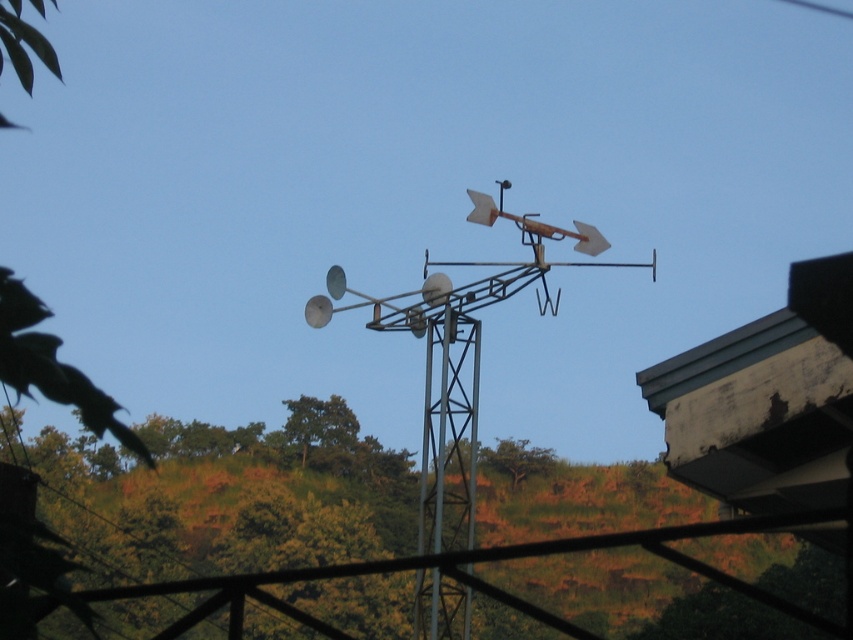
This screenshot has width=853, height=640. In order to click on metallic silver vane at center in this screenshot , I will do `click(459, 356)`.

Can you confirm if metallic silver vane at center is shorter than metallic gray pole at center?

Incorrect, metallic silver vane at center's height does not fall short of metallic gray pole at center's.

Locate an element on the screen. metallic silver vane at center is located at coordinates (459, 356).